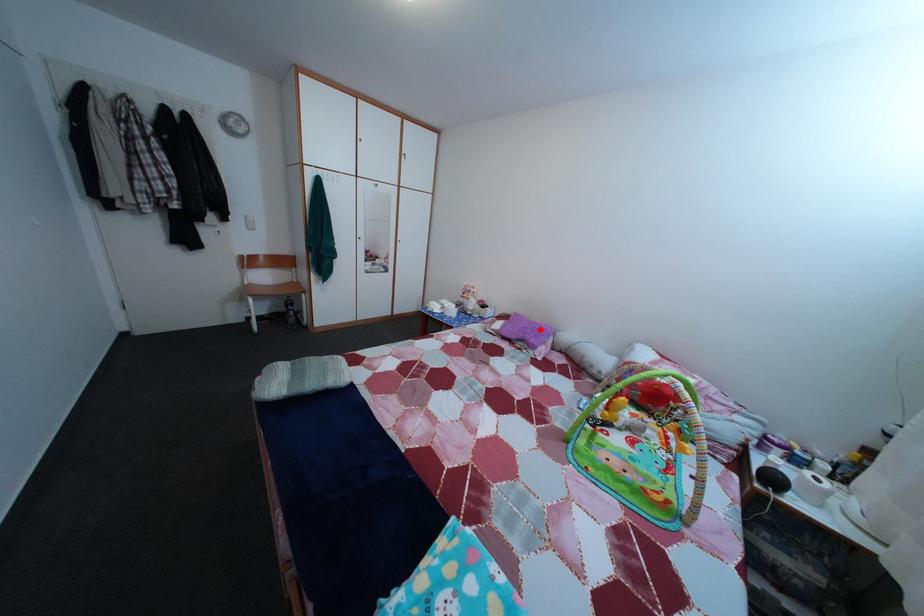
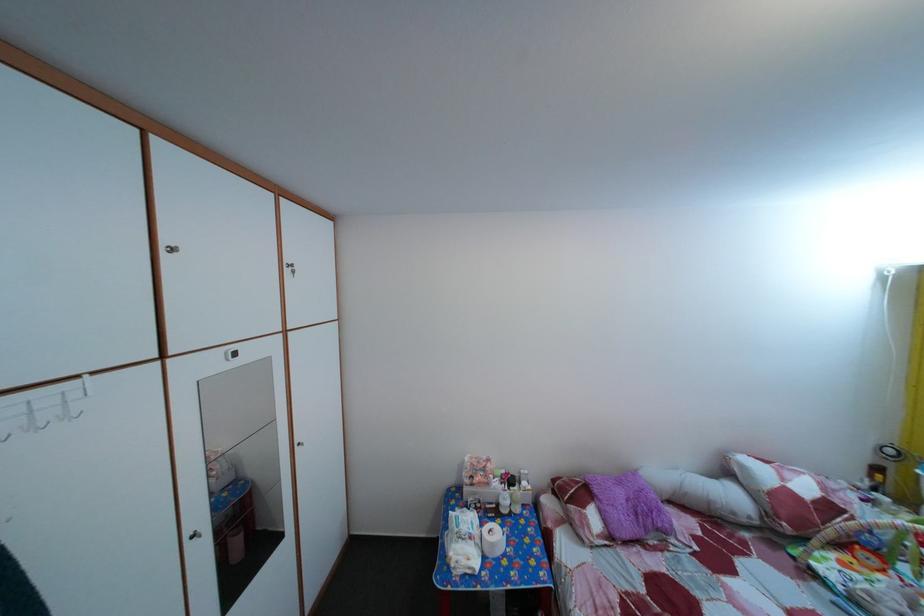
The point at the highlighted location is marked in the first image. Where is the corresponding point in the second image?

(629, 491)